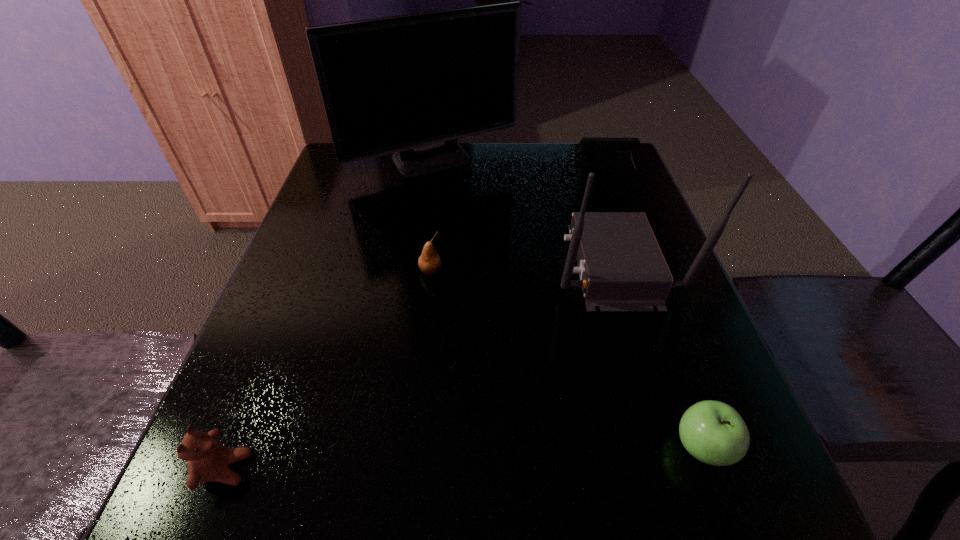
Identify the location of computer monitor positioned at the left edge. (412, 84).

Identify the location of teddy bear located in the left edge section of the desktop. (207, 459).

Where is `router positioned at the right edge`? router positioned at the right edge is located at coordinates (621, 267).

Locate an element on the screen. Image resolution: width=960 pixels, height=540 pixels. pistol that is at the right edge is located at coordinates pos(621,148).

The height and width of the screenshot is (540, 960). Find the location of `apple present at the right edge`. apple present at the right edge is located at coordinates (713, 432).

You are a GUI agent. You are given a task and a screenshot of the screen. Output one action in this format:
    pyautogui.click(x=<x>, y=<y>)
    Task: Click on the object positioned at the far left corner
    This screenshot has height=540, width=960.
    Given the screenshot: What is the action you would take?
    pyautogui.click(x=412, y=84)

In order to click on object that is at the near left corner in this screenshot , I will do `click(207, 459)`.

The width and height of the screenshot is (960, 540). In order to click on object that is at the far right corner in this screenshot , I will do `click(621, 148)`.

At what (x,y) coordinates should I click in order to perform the action: click on object present at the near right corner. Please return your answer as a coordinate pair (x, y). This screenshot has height=540, width=960. Looking at the image, I should click on (713, 432).

Locate an element on the screen. The width and height of the screenshot is (960, 540). vacant area at the far edge of the desktop is located at coordinates (507, 188).